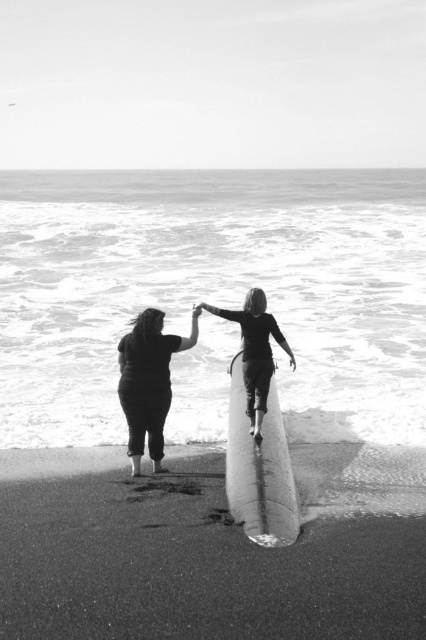
Question: Is white foam water at center positioned in front of matte black surfboard at center?

Choices:
 (A) no
 (B) yes

Answer: (A)

Question: Which of these objects is positioned closest to the white smooth surfboard at center?

Choices:
 (A) smooth sand at lower center
 (B) white foam water at center

Answer: (A)

Question: Does white foam water at center have a lesser width compared to smooth sand at lower center?

Choices:
 (A) yes
 (B) no

Answer: (B)

Question: Is white smooth surfboard at center wider than matte black surfboard at center?

Choices:
 (A) yes
 (B) no

Answer: (B)

Question: Which is nearer to the white smooth surfboard at center?

Choices:
 (A) matte black surfboard at center
 (B) white foam water at center
 (C) smooth white surfboard at center
 (D) smooth sand at lower center

Answer: (C)

Question: Which point appears closest to the camera in this image?

Choices:
 (A) (129, 337)
 (B) (276, 417)
 (C) (123, 304)

Answer: (A)